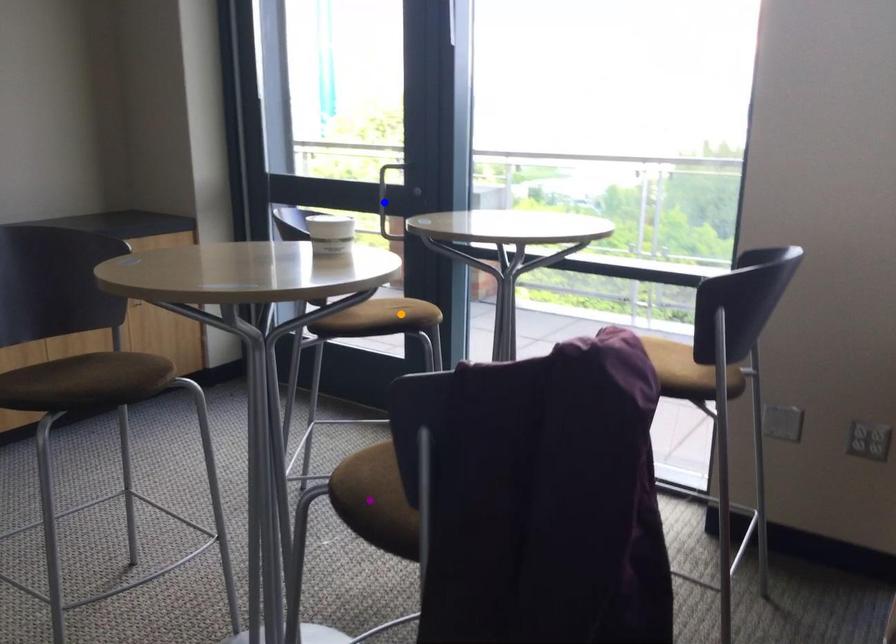
Order these from nearest to farthest:
1. orange point
2. blue point
3. purple point

blue point, orange point, purple point